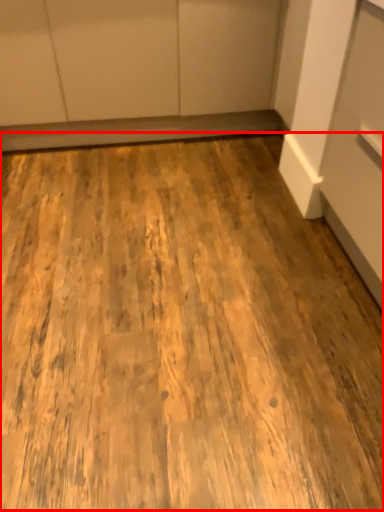
Question: Considering the relative positions of plywood (annotated by the red box) and cabinetry in the image provided, where is plywood (annotated by the red box) located with respect to the staircase?

Choices:
 (A) left
 (B) right

Answer: (B)